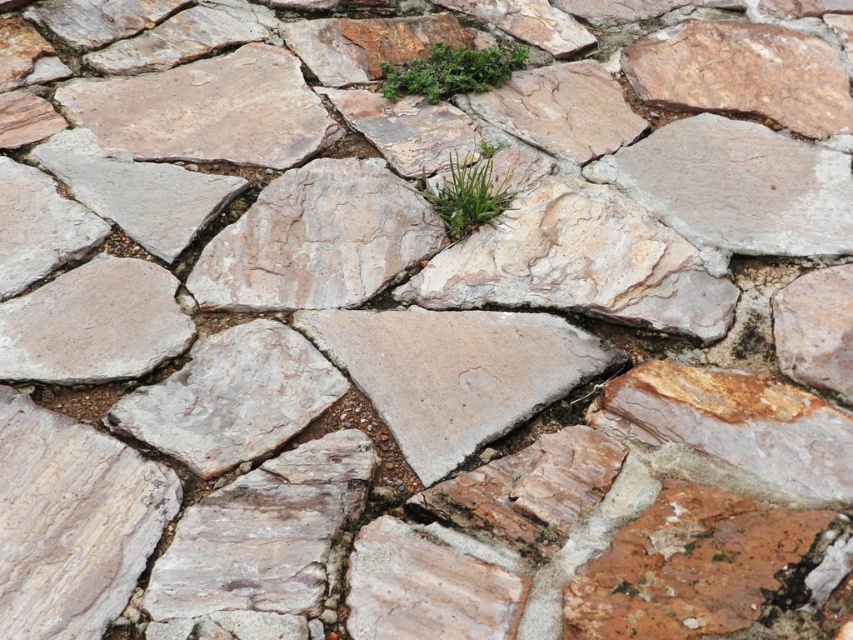
You are a gardener who wants to water the green leafy plant at upper center and the green leafy grass at center. Which one should you water first if you want to avoid getting water on the plant behind it?

The green leafy grass at center is behind the green leafy plant at upper center. To avoid getting water on the plant behind it, you should water the green leafy plant at upper center first before watering the green leafy grass at center.

You are standing on the stone pathway and notice two green leafy plants. One is labeled as the green leafy plant at upper center and the other as the green leafy grass at center. Which of these two plants is positioned to the right side of the other?

The green leafy plant at upper center is positioned to the right of the green leafy grass at center.

You are a gardener who wants to water the green leafy plant at upper center and the green leafy grass at center. Which one should you water first if you want to avoid wetting the grass?

The green leafy plant at upper center is positioned over green leafy grass at center, so watering the plant first would prevent water from dripping onto the grass below.